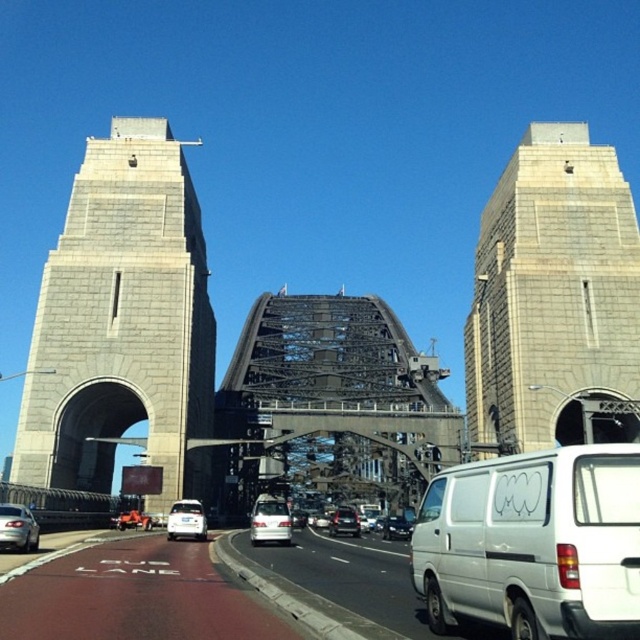
Between satin silver van at center and shiny silver sedan at center, which one is positioned higher?

satin silver van at center is above.

Based on the photo, is the position of satin silver van at center less distant than that of shiny silver sedan at center?

That is True.

In order to click on satin silver van at center in this screenshot , I will do `click(269, 520)`.

Can you confirm if gray stone tower at center is positioned below satin silver van at center?

No, gray stone tower at center is not below satin silver van at center.

Does gray stone tower at center appear on the right side of satin silver van at center?

Indeed, gray stone tower at center is positioned on the right side of satin silver van at center.

What do you see at coordinates (556, 298) in the screenshot?
I see `gray stone tower at center` at bounding box center [556, 298].

Locate an element on the screen. gray stone tower at center is located at coordinates (556, 298).

Where is `gray stone tower at left`? gray stone tower at left is located at coordinates (122, 323).